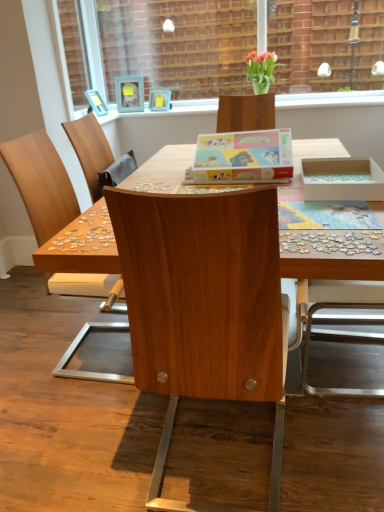
Question: From the image's perspective, is matte wooden picture frame at upper center, the 2th picture frame in the left-to-right sequence, above or below translucent glass vase at upper center?

Choices:
 (A) above
 (B) below

Answer: (B)

Question: Is matte wooden picture frame at upper center, the 2th picture frame in the left-to-right sequence, spatially inside translucent glass vase at upper center, or outside of it?

Choices:
 (A) inside
 (B) outside

Answer: (B)

Question: Which is nearer to the translucent glass vase at upper center?

Choices:
 (A) wooden desk at center
 (B) matte cardboard box at center
 (C) brick wall at upper center
 (D) matte wooden picture frame at upper center, marked as the first picture frame in a right-to-left arrangement
 (E) wooden photo frame at upper center, acting as the first picture frame starting from the left

Answer: (C)

Question: Considering the real-world distances, which object is closest to the wooden frame at upper center?

Choices:
 (A) matte wooden picture frame at upper center, the 2th picture frame in the left-to-right sequence
 (B) translucent glass vase at upper center
 (C) matte cardboard box at center
 (D) wooden desk at center
 (E) multicolored plastic puzzle pieces at right

Answer: (A)